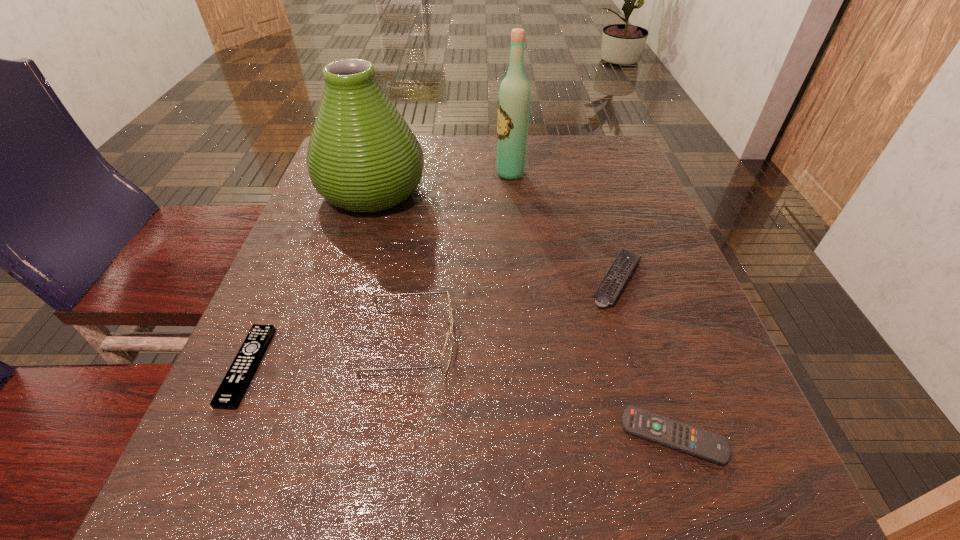
Identify the location of vacant space located on the front-facing side of the spectacles. The image size is (960, 540). (689, 339).

Locate an element on the screen. The image size is (960, 540). vacant space located 0.290m on the left of the farthest remote control is located at coordinates (432, 280).

The image size is (960, 540). What are the coordinates of `vacant space located on the right of the leftmost remote control` in the screenshot? It's located at (375, 366).

Where is `wine bottle at the far edge`? Image resolution: width=960 pixels, height=540 pixels. wine bottle at the far edge is located at coordinates (514, 98).

The height and width of the screenshot is (540, 960). I want to click on vase located at the far edge, so click(x=362, y=156).

Locate an element on the screen. The image size is (960, 540). object that is at the near edge is located at coordinates (700, 443).

Locate an element on the screen. The image size is (960, 540). vase situated at the left edge is located at coordinates (362, 156).

Where is `remote control positioned at the left edge`? Image resolution: width=960 pixels, height=540 pixels. remote control positioned at the left edge is located at coordinates (232, 388).

Where is `object that is at the far left corner`? object that is at the far left corner is located at coordinates (362, 156).

You are a GUI agent. You are given a task and a screenshot of the screen. Output one action in this format:
    pyautogui.click(x=<x>, y=<y>)
    Task: Click on the object located at the near right corner
    The height and width of the screenshot is (540, 960).
    Given the screenshot: What is the action you would take?
    pyautogui.click(x=700, y=443)